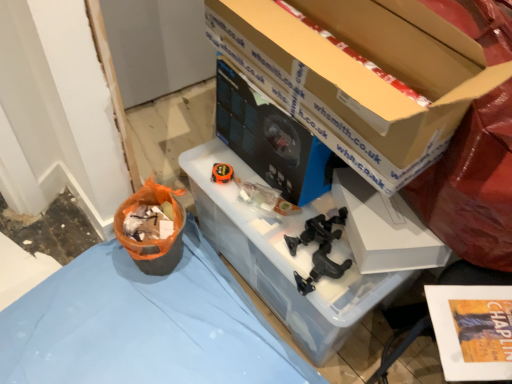
Question: Which direction should I rotate to look at white matte box at center, acting as the 1th box starting from the bottom, — up or down?

Choices:
 (A) down
 (B) up

Answer: (A)

Question: Is black plastic clamps at center, which ranks as the 2th toy in back-to-front order, touching matte black desktop computer at center?

Choices:
 (A) no
 (B) yes

Answer: (A)

Question: From the image's perspective, is black plastic clamps at center, positioned as the first toy in bottom-to-top order, beneath matte black desktop computer at center?

Choices:
 (A) yes
 (B) no

Answer: (A)

Question: Does black plastic clamps at center, the second toy when ordered from top to bottom, come behind matte black desktop computer at center?

Choices:
 (A) no
 (B) yes

Answer: (B)

Question: From the image's perspective, is black plastic clamps at center, positioned as the first toy in right-to-left order, over matte black desktop computer at center?

Choices:
 (A) yes
 (B) no

Answer: (B)

Question: Does black plastic clamps at center, positioned as the first toy in right-to-left order, have a greater height compared to matte black desktop computer at center?

Choices:
 (A) no
 (B) yes

Answer: (A)

Question: Is matte black desktop computer at center at the back of black plastic clamps at center, the second toy when ordered from top to bottom?

Choices:
 (A) no
 (B) yes

Answer: (A)

Question: Is black plastic clamps at center, positioned as the first toy in bottom-to-top order, further to camera compared to orange plastic basket at lower left?

Choices:
 (A) no
 (B) yes

Answer: (A)

Question: Considering the relative sizes of black plastic clamps at center, the first toy from the front, and orange plastic basket at lower left in the image provided, is black plastic clamps at center, the first toy from the front, bigger than orange plastic basket at lower left?

Choices:
 (A) no
 (B) yes

Answer: (A)

Question: Considering the relative sizes of black plastic clamps at center, the 2th toy positioned from the left, and orange plastic basket at lower left in the image provided, is black plastic clamps at center, the 2th toy positioned from the left, shorter than orange plastic basket at lower left?

Choices:
 (A) yes
 (B) no

Answer: (A)

Question: From the image's perspective, is black plastic clamps at center, positioned as the first toy in bottom-to-top order, beneath orange plastic basket at lower left?

Choices:
 (A) no
 (B) yes

Answer: (B)

Question: Is black plastic clamps at center, the first toy from the front, not close to orange plastic basket at lower left?

Choices:
 (A) no
 (B) yes

Answer: (A)

Question: Does black plastic clamps at center, positioned as the first toy in bottom-to-top order, have a smaller size compared to orange plastic basket at lower left?

Choices:
 (A) no
 (B) yes

Answer: (B)

Question: Does black plastic clamps at center, the 2th toy positioned from the left, have a greater width compared to clear plastic storage box at center?

Choices:
 (A) yes
 (B) no

Answer: (B)